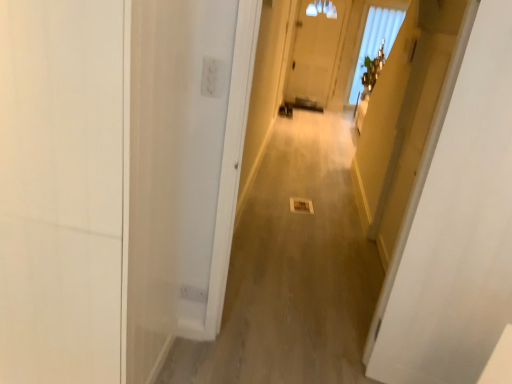
Question: Does white glossy door at upper right, acting as the second door starting from the left, have a lesser height compared to smooth beige carpet at center?

Choices:
 (A) yes
 (B) no

Answer: (B)

Question: Does white glossy door at upper right, acting as the second door starting from the left, appear on the right side of smooth beige carpet at center?

Choices:
 (A) yes
 (B) no

Answer: (A)

Question: Does white glossy door at upper right, acting as the second door starting from the left, have a lesser width compared to smooth beige carpet at center?

Choices:
 (A) yes
 (B) no

Answer: (A)

Question: Does white glossy door at upper right, arranged as the first door when viewed from the right, lie in front of smooth beige carpet at center?

Choices:
 (A) no
 (B) yes

Answer: (B)

Question: Are white glossy door at upper right, arranged as the first door when viewed from the right, and smooth beige carpet at center located far from each other?

Choices:
 (A) no
 (B) yes

Answer: (A)

Question: Considering the relative sizes of white glossy door at upper right, acting as the second door starting from the left, and smooth beige carpet at center in the image provided, is white glossy door at upper right, acting as the second door starting from the left, taller than smooth beige carpet at center?

Choices:
 (A) no
 (B) yes

Answer: (B)

Question: Does white matte door at left, positioned as the second door in right-to-left order, appear on the right side of smooth beige carpet at center?

Choices:
 (A) yes
 (B) no

Answer: (B)

Question: Does white matte door at left, positioned as the second door in right-to-left order, have a smaller size compared to smooth beige carpet at center?

Choices:
 (A) yes
 (B) no

Answer: (B)

Question: From the image's perspective, is white matte door at left, the 1th door viewed from the left, located above smooth beige carpet at center?

Choices:
 (A) yes
 (B) no

Answer: (B)

Question: From the image's perspective, does white matte door at left, the 1th door viewed from the left, appear lower than smooth beige carpet at center?

Choices:
 (A) yes
 (B) no

Answer: (A)

Question: From a real-world perspective, is white matte door at left, the 1th door viewed from the left, physically above smooth beige carpet at center?

Choices:
 (A) yes
 (B) no

Answer: (A)

Question: Considering the relative positions of white matte door at left, positioned as the second door in right-to-left order, and smooth beige carpet at center in the image provided, is white matte door at left, positioned as the second door in right-to-left order, in front of smooth beige carpet at center?

Choices:
 (A) no
 (B) yes

Answer: (B)

Question: Is white matte door at left, positioned as the second door in right-to-left order, taller than white glossy door at upper right, acting as the second door starting from the left?

Choices:
 (A) yes
 (B) no

Answer: (B)